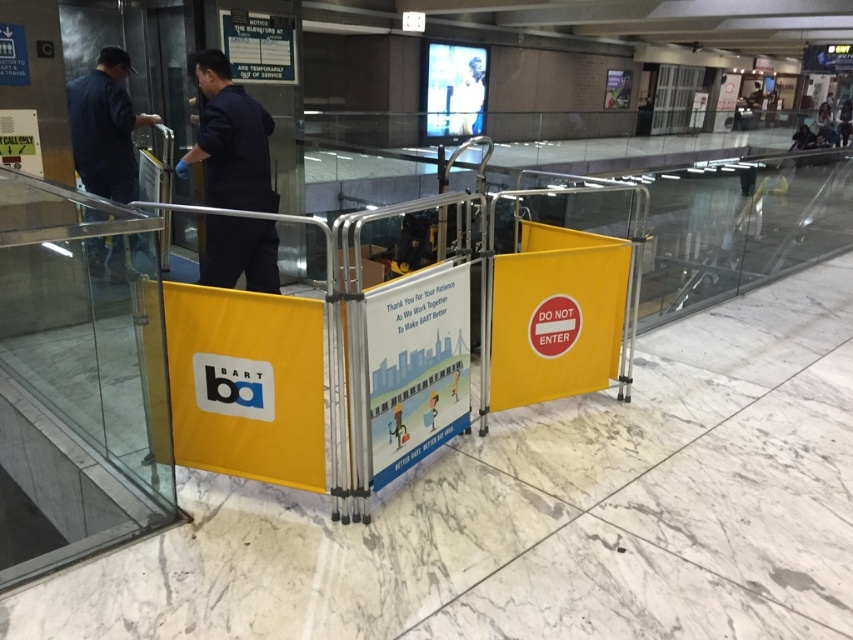
Between dark blue uniform at center and dark blue uniform at left, which one is positioned higher?

Positioned higher is dark blue uniform at left.

Does point (227, 192) come farther from viewer compared to point (73, 122)?

No, (227, 192) is in front of (73, 122).

I want to click on dark blue uniform at center, so click(x=229, y=140).